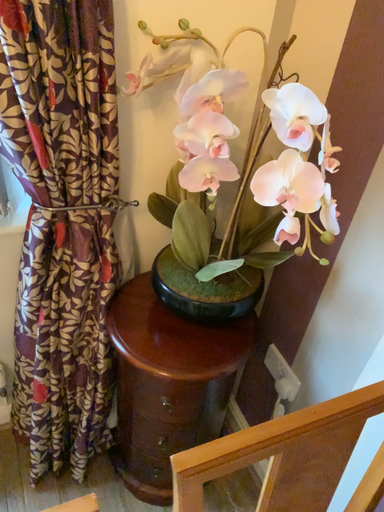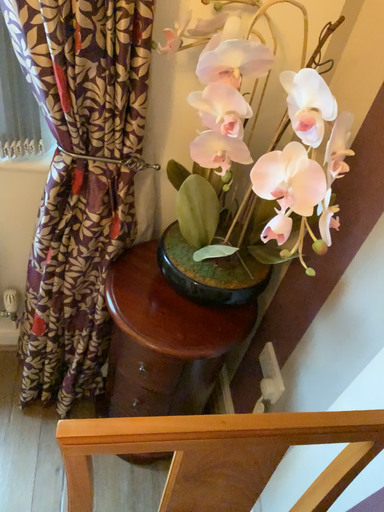
Question: How did the camera likely rotate when shooting the video?

Choices:
 (A) rotated left
 (B) rotated right

Answer: (A)